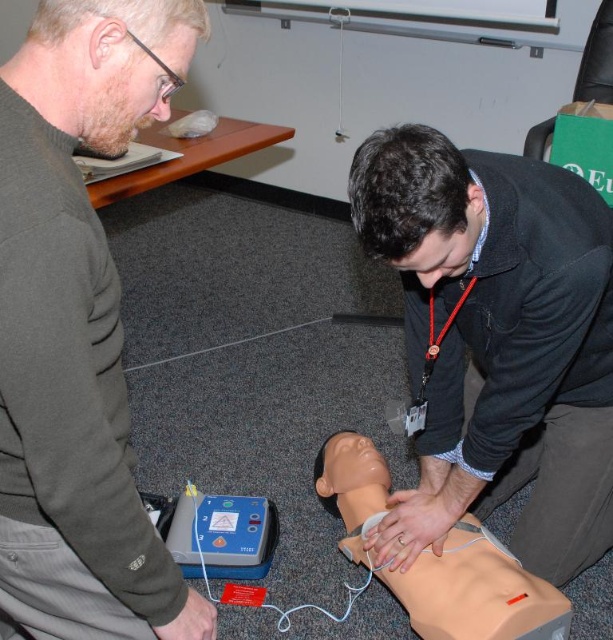
Question: Is matte black jacket at lower center below beige rubber mannequin torso at center?

Choices:
 (A) no
 (B) yes

Answer: (A)

Question: Where is matte black jacket at lower center located in relation to gray plastic defibrillator at lower center in the image?

Choices:
 (A) right
 (B) left

Answer: (A)

Question: Which of the following is the farthest from the observer?

Choices:
 (A) beige rubber mannequin torso at center
 (B) dark gray sweater at left

Answer: (A)

Question: Which of the following is the closest to the observer?

Choices:
 (A) (536, 588)
 (B) (508, 372)
 (C) (264, 525)

Answer: (B)

Question: Among these points, which one is nearest to the camera?

Choices:
 (A) (161, 637)
 (B) (503, 426)
 (C) (413, 577)

Answer: (A)

Question: Does dark gray sweater at left have a greater width compared to matte black jacket at lower center?

Choices:
 (A) yes
 (B) no

Answer: (B)